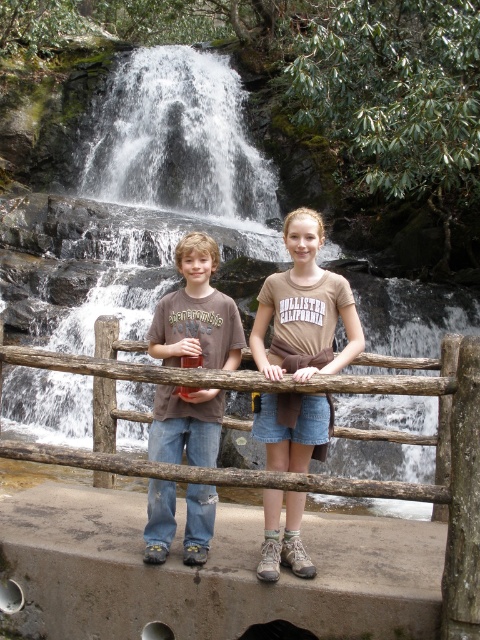
Question: Can you confirm if white frothy water at upper center is positioned below brown cotton shirt at center?

Choices:
 (A) no
 (B) yes

Answer: (A)

Question: Can you confirm if brown wooden fence at center is positioned above brown cotton shirt at center?

Choices:
 (A) yes
 (B) no

Answer: (B)

Question: In this image, where is brown wooden fence at center located relative to brown cotton shirt at center?

Choices:
 (A) above
 (B) below

Answer: (B)

Question: Which object is closer to the camera taking this photo?

Choices:
 (A) brown wooden fence at center
 (B) brown cotton shirt at center
 (C) white frothy water at upper center

Answer: (A)

Question: Based on their relative distances, which object is farther from the brown cotton t-shirt at center?

Choices:
 (A) brown wooden fence at center
 (B) white frothy water at upper center
 (C) brown cotton shirt at center

Answer: (B)

Question: Which of the following is the farthest from the observer?

Choices:
 (A) (235, 324)
 (B) (290, 426)
 (C) (238, 586)
 (D) (142, 188)

Answer: (D)